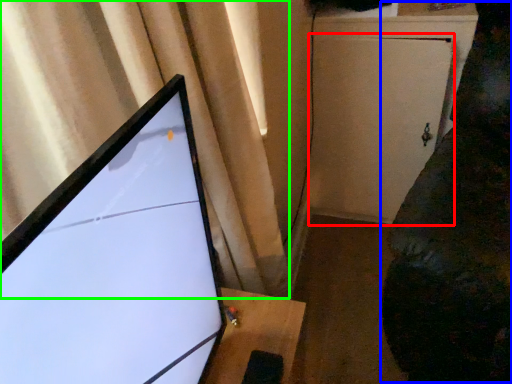
Question: Estimate the real-world distances between objects in this image. Which object is closer to screen door (highlighted by a red box), couch (highlighted by a blue box) or curtain (highlighted by a green box)?

Choices:
 (A) couch
 (B) curtain

Answer: (A)